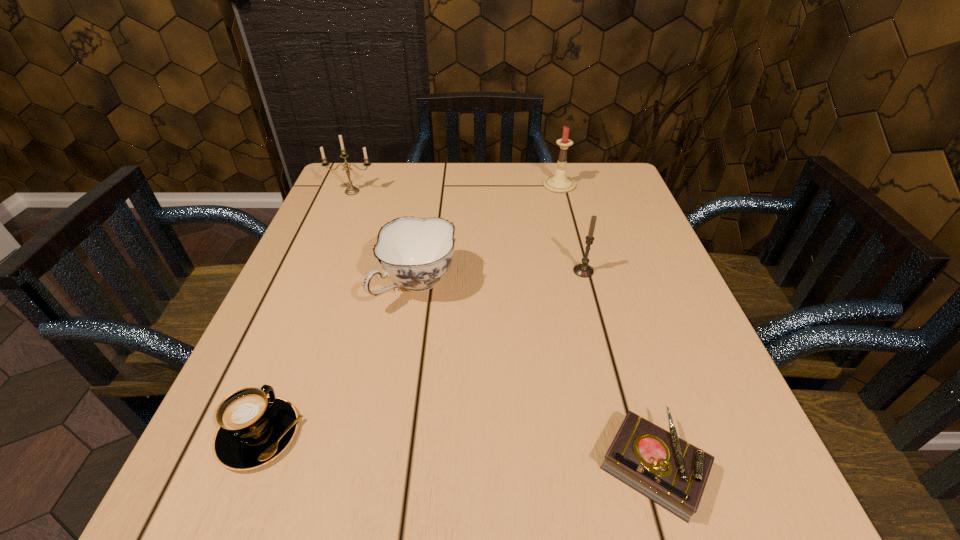
At what (x,y) coordinates should I click in order to perform the action: click on the leftmost candle. Please return your answer as a coordinate pair (x, y). Image resolution: width=960 pixels, height=540 pixels. Looking at the image, I should click on (351, 190).

At what (x,y) coordinates should I click in order to perform the action: click on the nearest candle. Please return your answer as a coordinate pair (x, y). The width and height of the screenshot is (960, 540). Looking at the image, I should click on (583, 270).

Locate an element on the screen. The height and width of the screenshot is (540, 960). the fourth tallest object is located at coordinates (415, 253).

The image size is (960, 540). Find the location of `the third object from left to right`. the third object from left to right is located at coordinates (415, 253).

Locate an element on the screen. The width and height of the screenshot is (960, 540). the fifth tallest object is located at coordinates (254, 429).

At what (x,y) coordinates should I click in order to perform the action: click on diary. Please return your answer as a coordinate pair (x, y). This screenshot has width=960, height=540. Looking at the image, I should click on (673, 473).

Identify the location of free space located 0.270m on the right of the leftmost candle. The width and height of the screenshot is (960, 540). coord(478,192).

The width and height of the screenshot is (960, 540). What are the coordinates of `free space located 0.220m on the left of the nearest candle` in the screenshot? It's located at (469, 271).

Where is `free space located 0.210m on the back of the fourth object from right to left`? Image resolution: width=960 pixels, height=540 pixels. free space located 0.210m on the back of the fourth object from right to left is located at coordinates coord(429,205).

Identify the location of vacant space located 0.330m on the right of the fifth tallest object. This screenshot has width=960, height=540. (521, 434).